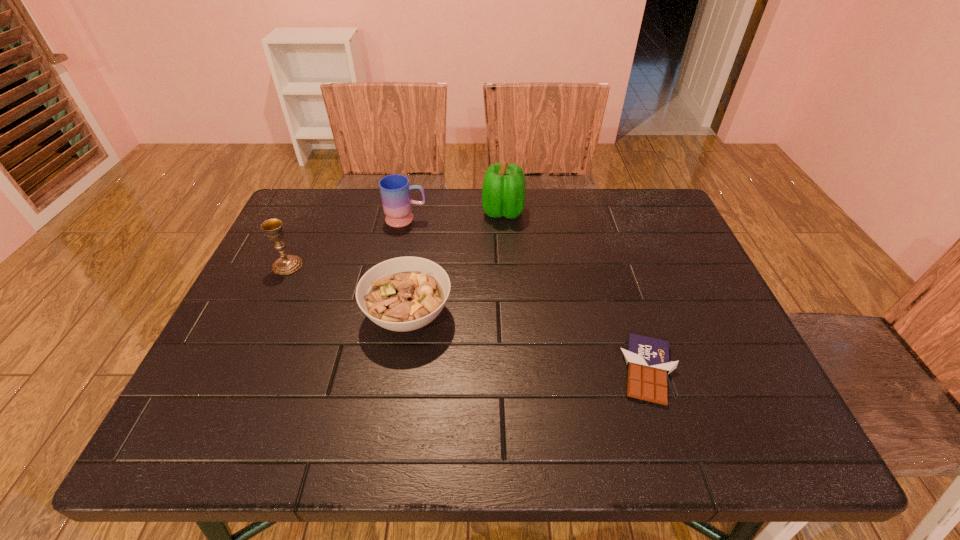
In order to click on vacant space at the right edge in this screenshot , I will do `click(670, 311)`.

Find the location of a particular element. Image resolution: width=960 pixels, height=540 pixels. free space at the far left corner of the desktop is located at coordinates (335, 221).

Locate an element on the screen. The width and height of the screenshot is (960, 540). free space at the far right corner of the desktop is located at coordinates (652, 233).

Locate an element on the screen. The image size is (960, 540). empty space between the mug and the chocolate bar is located at coordinates (527, 295).

Find the location of a particular element. empty location between the fourth object from left to right and the chocolate bar is located at coordinates (575, 291).

The width and height of the screenshot is (960, 540). Find the location of `vacant space in between the leftmost object and the mug`. vacant space in between the leftmost object and the mug is located at coordinates (347, 242).

Locate an element on the screen. This screenshot has width=960, height=540. free space between the mug and the rightmost object is located at coordinates (527, 295).

Identify the location of vacant space that's between the fourth object from left to right and the chocolate bar. (575, 291).

Find the location of a particular element. This screenshot has height=540, width=960. empty space between the fourth tallest object and the tallest object is located at coordinates (456, 263).

This screenshot has height=540, width=960. In order to click on free space between the stew and the tallest object in this screenshot , I will do `click(456, 263)`.